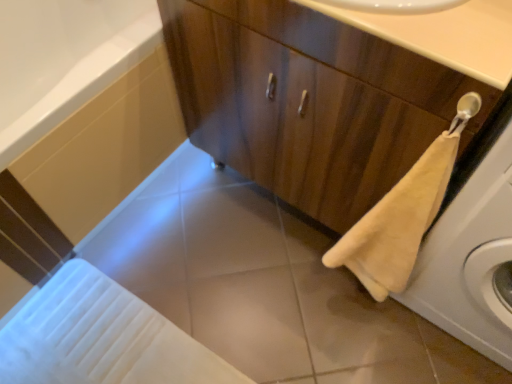
Locate an element on the screen. beige plush towel at lower right is located at coordinates (398, 222).

This screenshot has width=512, height=384. Identify the location of wooden cabinet at center. (308, 101).

Considering the positions of objects white glossy bath at lower left and smooth beige countertop at upper center in the image provided, who is behind, white glossy bath at lower left or smooth beige countertop at upper center?

white glossy bath at lower left.

Is white glossy bath at lower left far away from smooth beige countertop at upper center?

white glossy bath at lower left is actually quite close to smooth beige countertop at upper center.

Who is bigger, white glossy bath at lower left or smooth beige countertop at upper center?

With larger size is white glossy bath at lower left.

Looking at this image, between beige fabric washing machine at right and white glossy tile at center, which one appears on the right side from the viewer's perspective?

From the viewer's perspective, beige fabric washing machine at right appears more on the right side.

Could you tell me if beige fabric washing machine at right is facing white glossy tile at center?

No, beige fabric washing machine at right is not turned towards white glossy tile at center.

Measure the distance between beige fabric washing machine at right and white glossy tile at center.

A distance of 18.50 inches exists between beige fabric washing machine at right and white glossy tile at center.

Is beige plush towel at lower right not within beige fabric washing machine at right?

beige plush towel at lower right lies outside beige fabric washing machine at right's area.

You are a GUI agent. You are given a task and a screenshot of the screen. Output one action in this format:
    pyautogui.click(x=<x>, y=<y>)
    Task: Click on the washing machine to the right of beige plush towel at lower right
    The width and height of the screenshot is (512, 384).
    Given the screenshot: What is the action you would take?
    pyautogui.click(x=471, y=260)

Is beige plush towel at lower right looking in the opposite direction of beige fabric washing machine at right?

No, beige plush towel at lower right is not facing away from beige fabric washing machine at right.

Which is more to the left, beige plush towel at lower right or beige fabric washing machine at right?

Positioned to the left is beige plush towel at lower right.

Is beige fabric washing machine at right turned away from white glossy bath at lower left?

beige fabric washing machine at right does not have its back to white glossy bath at lower left.

Does point (432, 310) come closer to viewer compared to point (24, 6)?

Yes, point (432, 310) is closer to viewer.

Could white glossy bath at lower left be considered to be inside beige fabric washing machine at right?

That's incorrect, white glossy bath at lower left is not inside beige fabric washing machine at right.

Is beige fabric washing machine at right to the right of white glossy bath at lower left from the viewer's perspective?

Yes, beige fabric washing machine at right is to the right of white glossy bath at lower left.

From a real-world perspective, which object stands above the other?

smooth beige countertop at upper center is physically above.

Is white glossy tile at center oriented away from smooth beige countertop at upper center?

No, white glossy tile at center is not facing away from smooth beige countertop at upper center.

Measure the distance from white glossy tile at center to smooth beige countertop at upper center.

white glossy tile at center and smooth beige countertop at upper center are 89.34 centimeters apart.

Considering the relative sizes of white glossy tile at center and smooth beige countertop at upper center in the image provided, is white glossy tile at center taller than smooth beige countertop at upper center?

In fact, white glossy tile at center may be shorter than smooth beige countertop at upper center.

Is smooth beige countertop at upper center closer to the viewer compared to beige fabric washing machine at right?

No, it is behind beige fabric washing machine at right.

Can you confirm if smooth beige countertop at upper center is bigger than beige fabric washing machine at right?

No, smooth beige countertop at upper center is not bigger than beige fabric washing machine at right.

From the image's perspective, is smooth beige countertop at upper center located above or below beige fabric washing machine at right?

smooth beige countertop at upper center is situated higher than beige fabric washing machine at right in the image.

How many degrees apart are the facing directions of smooth beige countertop at upper center and beige fabric washing machine at right?

There is a 1.11e-05-degree angle between the facing directions of smooth beige countertop at upper center and beige fabric washing machine at right.

How far apart are beige plush towel at lower right and white glossy tile at center?

A distance of 15.12 inches exists between beige plush towel at lower right and white glossy tile at center.

Is beige plush towel at lower right facing towards white glossy tile at center?

No, beige plush towel at lower right is not oriented towards white glossy tile at center.

Consider the image. What's the angular difference between beige plush towel at lower right and white glossy tile at center's facing directions?

There is a 5.05-degree angle between the facing directions of beige plush towel at lower right and white glossy tile at center.

From the image's perspective, which is below, beige plush towel at lower right or white glossy tile at center?

white glossy tile at center appears lower in the image.

In order to click on counter top lying in front of the white glossy bath at lower left in this screenshot , I will do `click(445, 35)`.

Find the location of a particular element. tile below the beige fabric washing machine at right (from a real-world perspective) is located at coordinates (252, 322).

Based on their spatial positions, is wooden cabinet at center or smooth beige countertop at upper center further from white glossy bath at lower left?

smooth beige countertop at upper center is further to white glossy bath at lower left.

From the image, which object appears to be nearer to smooth beige countertop at upper center, beige plush towel at lower right or white glossy bath at lower left?

The object closer to smooth beige countertop at upper center is beige plush towel at lower right.

From the image, which object appears to be nearer to white glossy tile at center, white glossy bath at lower left or wooden cabinet at center?

wooden cabinet at center lies closer to white glossy tile at center than the other object.

Considering their positions, is beige plush towel at lower right positioned further to wooden cabinet at center than white glossy tile at center?

The object further to wooden cabinet at center is white glossy tile at center.

Which object lies nearer to the anchor point white glossy bath at lower left, beige fabric washing machine at right or smooth beige countertop at upper center?

smooth beige countertop at upper center is positioned closer to the anchor white glossy bath at lower left.

Which object lies nearer to the anchor point beige fabric washing machine at right, beige plush towel at lower right or smooth beige countertop at upper center?

beige plush towel at lower right lies closer to beige fabric washing machine at right than the other object.

In the scene shown: Looking at the image, which one is located further to beige fabric washing machine at right, smooth beige countertop at upper center or beige plush towel at lower right?

Among the two, smooth beige countertop at upper center is located further to beige fabric washing machine at right.

Considering their positions, is beige plush towel at lower right positioned further to white glossy bath at lower left than wooden cabinet at center?

beige plush towel at lower right lies further to white glossy bath at lower left than the other object.

Where is `bathroom cabinet between white glossy bath at lower left and beige fabric washing machine at right in the horizontal direction`? The image size is (512, 384). bathroom cabinet between white glossy bath at lower left and beige fabric washing machine at right in the horizontal direction is located at coordinates (308, 101).

The image size is (512, 384). In order to click on counter top between white glossy bath at lower left and beige plush towel at lower right in this screenshot , I will do `click(445, 35)`.

Locate an element on the screen. bathroom cabinet between white glossy bath at lower left and beige plush towel at lower right from left to right is located at coordinates (308, 101).

The height and width of the screenshot is (384, 512). I want to click on bath towel that lies between smooth beige countertop at upper center and white glossy tile at center from top to bottom, so click(x=398, y=222).